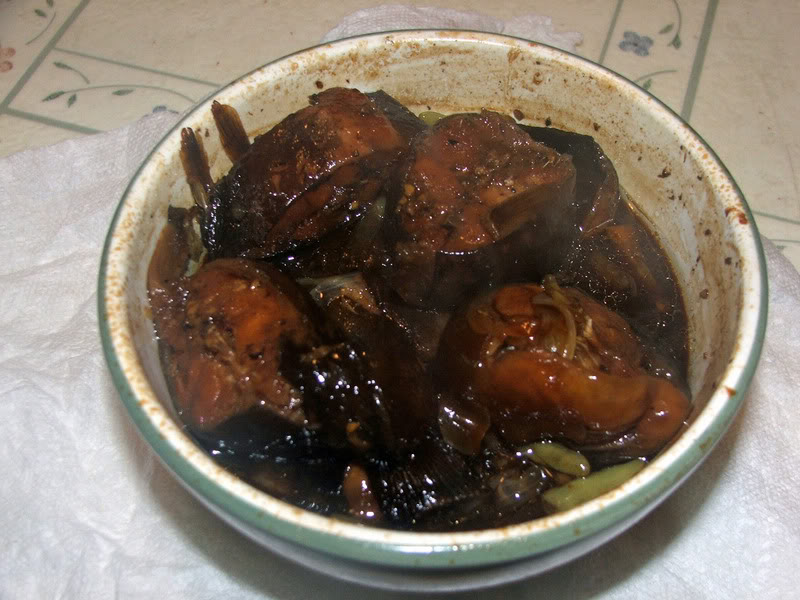
Locate an element on the screen. paper towel is located at coordinates (62, 350).